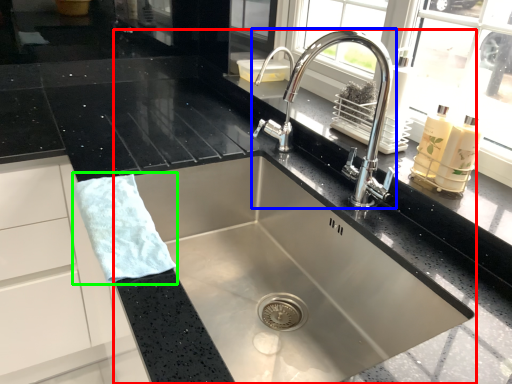
Question: Estimate the real-world distances between objects in this image. Which object is farther from sink (highlighted by a red box), tap (highlighted by a blue box) or hand towel (highlighted by a green box)?

Choices:
 (A) tap
 (B) hand towel

Answer: (B)